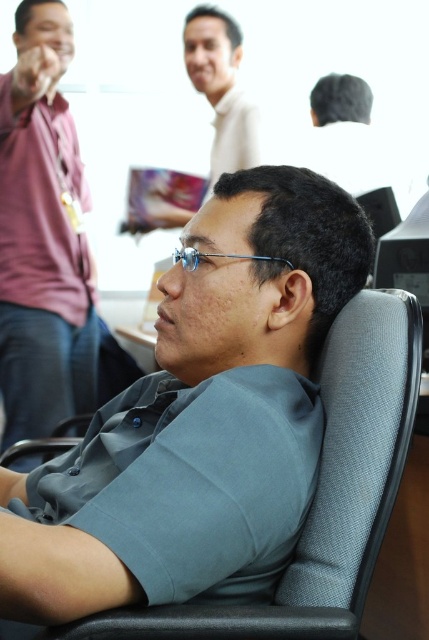
Question: Does gray fabric swivel chair at center appear under dark gray fabric cap at upper right?

Choices:
 (A) yes
 (B) no

Answer: (A)

Question: Which of the following is the closest to the observer?

Choices:
 (A) matte maroon shirt at left
 (B) dark gray fabric cap at upper right
 (C) gray fabric swivel chair at center

Answer: (C)

Question: Can you confirm if matte maroon shirt at left is positioned to the left of matte white shirt at upper center?

Choices:
 (A) yes
 (B) no

Answer: (A)

Question: Can you confirm if matte maroon shirt at left is positioned above dark gray fabric cap at upper right?

Choices:
 (A) yes
 (B) no

Answer: (B)

Question: Among these points, which one is farthest from the camera?

Choices:
 (A) (71, 225)
 (B) (181, 225)

Answer: (B)

Question: Which of the following is the farthest from the observer?

Choices:
 (A) (108, 612)
 (B) (244, 164)

Answer: (B)